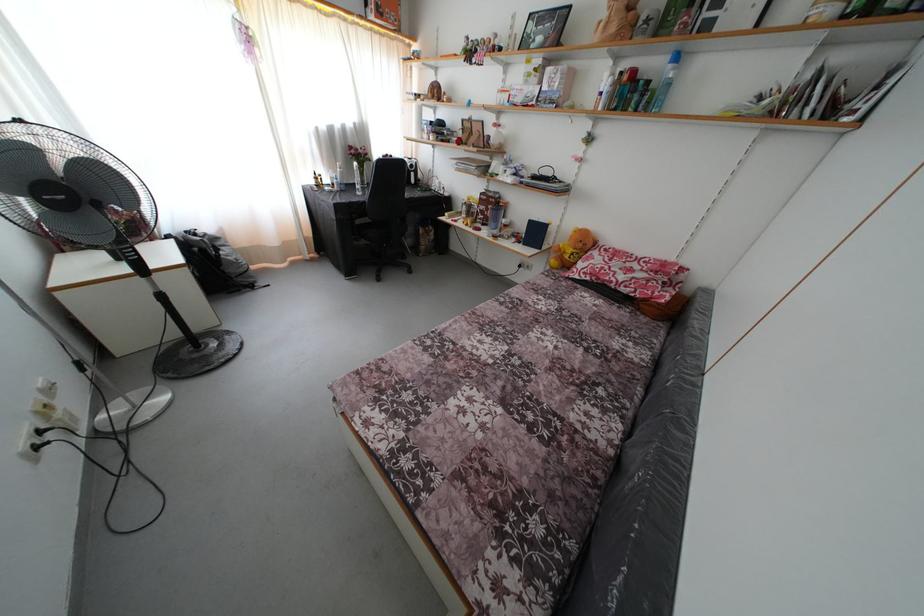
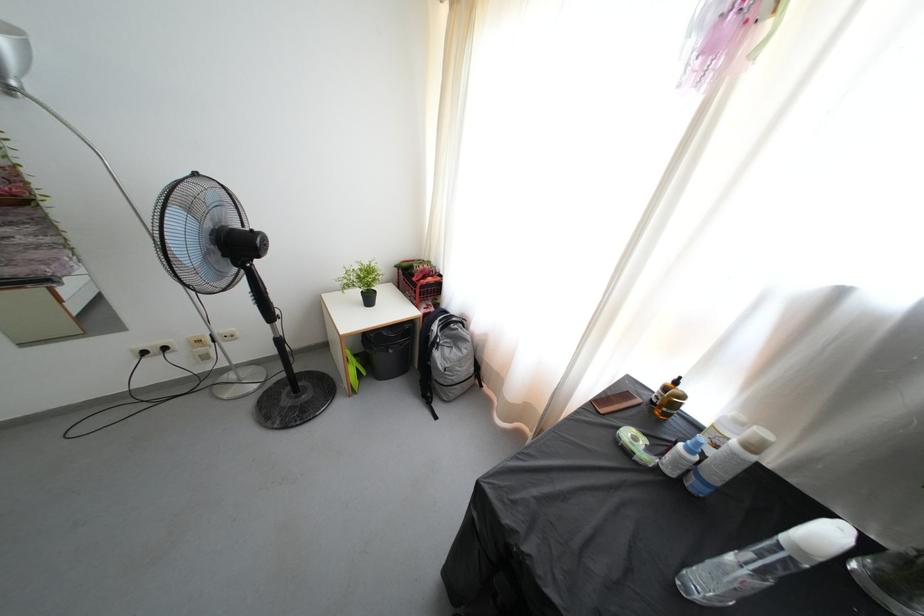
The point at (x=336, y=198) is marked in the first image. Where is the corresponding point in the second image?

(631, 458)